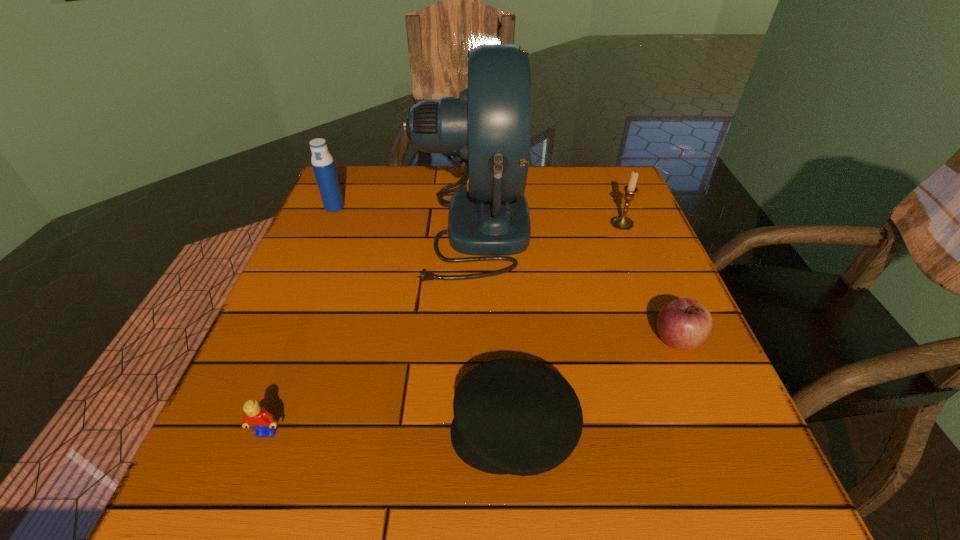
Where is `vacant region that satisfies the following two spatial constraints: 1. in front of the fan to blow air; 2. on the front-facing side of the Lego`? vacant region that satisfies the following two spatial constraints: 1. in front of the fan to blow air; 2. on the front-facing side of the Lego is located at coordinates (468, 432).

At what (x,y) coordinates should I click in order to perform the action: click on free space that satisfies the following two spatial constraints: 1. on the front side of the fourth shortest object; 2. on the right side of the water bottle. Please return your answer as a coordinate pair (x, y). The width and height of the screenshot is (960, 540). Looking at the image, I should click on (327, 224).

Locate an element on the screen. free point that satisfies the following two spatial constraints: 1. in front of the tallest object to blow air; 2. on the right side of the fourth farthest object is located at coordinates (469, 341).